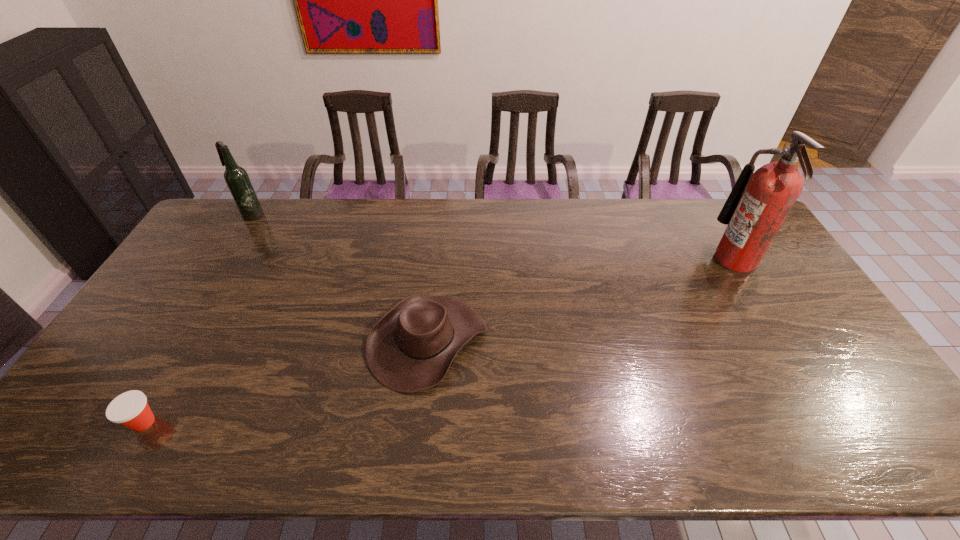
This screenshot has height=540, width=960. What are the coordinates of `the second farthest object` in the screenshot? It's located at (760, 201).

Locate an element on the screen. the tallest object is located at coordinates (760, 201).

Locate an element on the screen. The height and width of the screenshot is (540, 960). the farthest object is located at coordinates (237, 179).

In order to click on the third shortest object in this screenshot , I will do (237, 179).

Find the location of `the third object from left to right`. the third object from left to right is located at coordinates (410, 349).

You are a GUI agent. You are given a task and a screenshot of the screen. Output one action in this format:
    pyautogui.click(x=<x>, y=<y>)
    Task: Click on the cowboy hat
    
    Given the screenshot: What is the action you would take?
    pyautogui.click(x=410, y=349)

You are a GUI agent. You are given a task and a screenshot of the screen. Output one action in this format:
    pyautogui.click(x=<x>, y=<y>)
    Task: Click on the nearest object
    The width and height of the screenshot is (960, 540).
    Given the screenshot: What is the action you would take?
    pyautogui.click(x=130, y=409)

Where is `Dixie cup`? Image resolution: width=960 pixels, height=540 pixels. Dixie cup is located at coordinates (130, 409).

Where is `vacant space located 0.100m on the front of the rightmost object near the operation label`? The image size is (960, 540). vacant space located 0.100m on the front of the rightmost object near the operation label is located at coordinates (684, 260).

This screenshot has height=540, width=960. I want to click on free space located on the front of the rightmost object near the operation label, so click(694, 260).